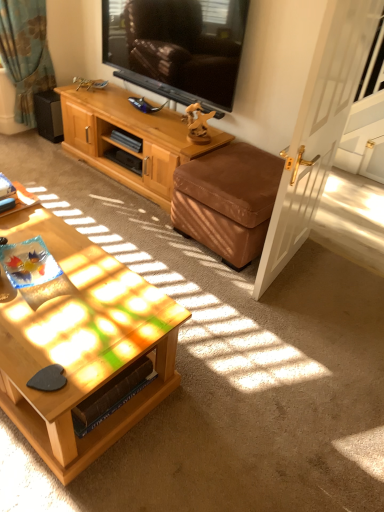
At what (x,y) coordinates should I click in order to perform the action: click on free area below white glossy door at right (from a real-world perspective). Please return your answer as a coordinate pair (x, y). This screenshot has height=512, width=384. Looking at the image, I should click on (290, 265).